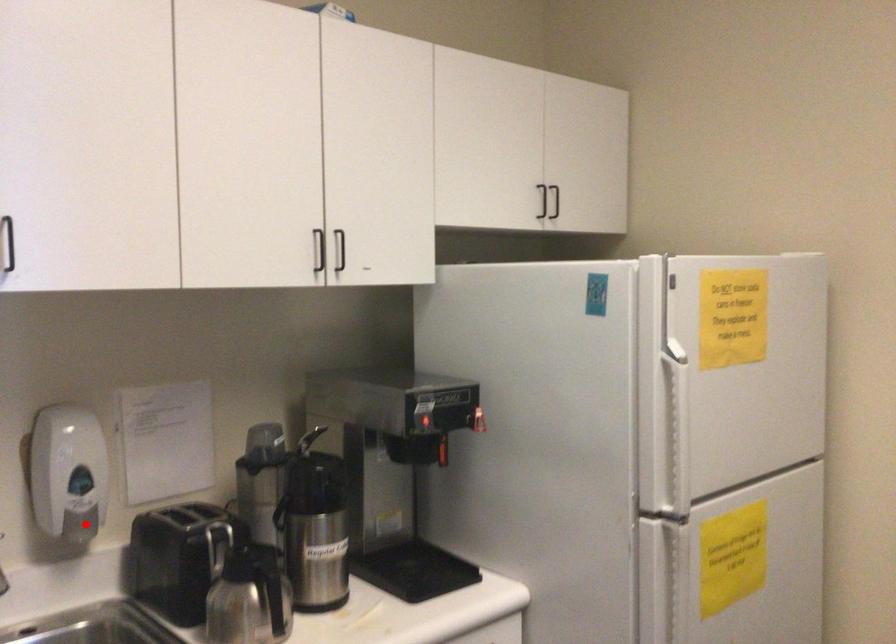
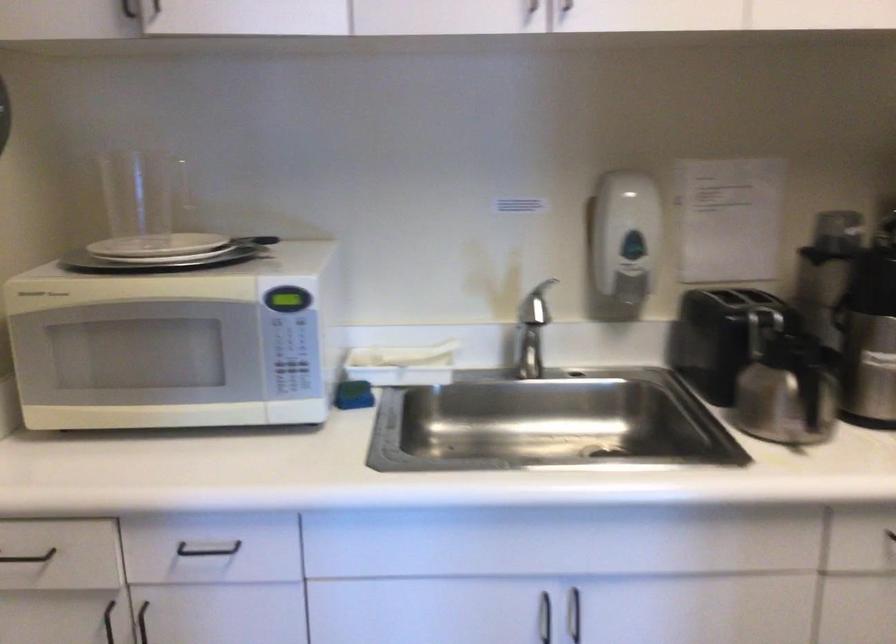
The point at the highlighted location is marked in the first image. Where is the corresponding point in the second image?

(631, 288)